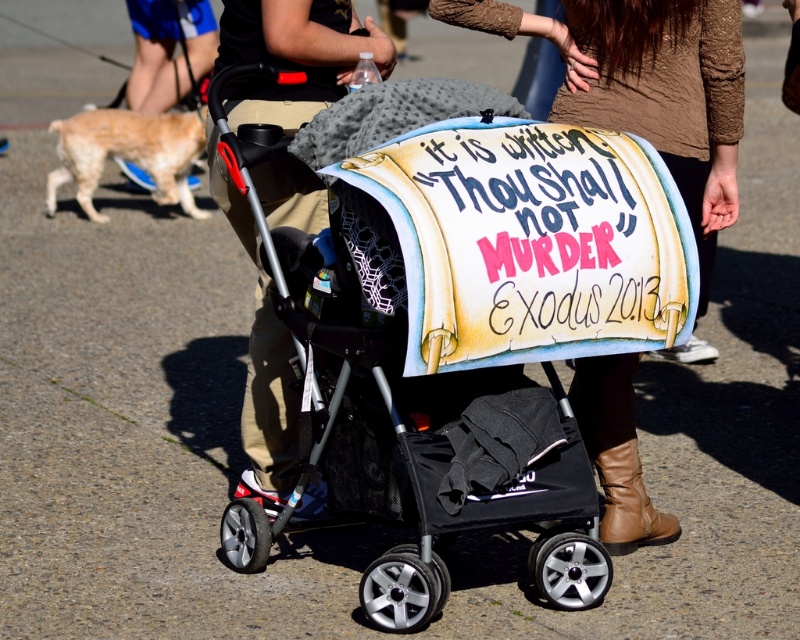
Question: Is brown textured sweater at upper center below tan leather boot at lower right?

Choices:
 (A) yes
 (B) no

Answer: (B)

Question: Among these objects, which one is nearest to the camera?

Choices:
 (A) light brown fur at left
 (B) brown textured sweater at upper center

Answer: (B)

Question: Which is nearer to the matte black stroller at center?

Choices:
 (A) tan leather boot at lower right
 (B) black fabric baby carriage at center
 (C) light brown fur at left
 (D) brown textured sweater at upper center

Answer: (B)

Question: Which point is farther from the camera taking this photo?

Choices:
 (A) (328, 205)
 (B) (68, 124)
 (C) (666, 67)
 (D) (316, 97)

Answer: (B)

Question: Is black fabric baby carriage at center thinner than brown textured sweater at upper center?

Choices:
 (A) no
 (B) yes

Answer: (A)

Question: Can you confirm if light brown fur at left is positioned below tan leather boot at lower right?

Choices:
 (A) yes
 (B) no

Answer: (B)